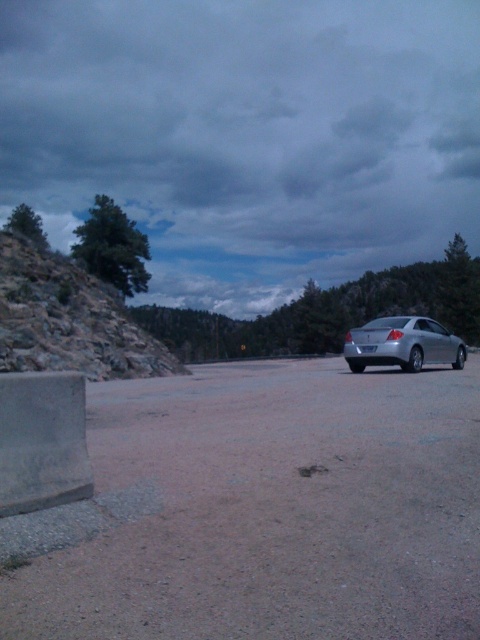
Question: Which object is farther from the camera taking this photo?

Choices:
 (A) silver metallic sedan at right
 (B) brown gravel dirt track at center

Answer: (A)

Question: Is brown gravel dirt track at center positioned before silver metallic sedan at right?

Choices:
 (A) yes
 (B) no

Answer: (A)

Question: Is brown gravel dirt track at center positioned before silver metallic sedan at right?

Choices:
 (A) yes
 (B) no

Answer: (A)

Question: Among these objects, which one is farthest from the camera?

Choices:
 (A) silver metallic sedan at right
 (B) brown gravel dirt track at center

Answer: (A)

Question: Is brown gravel dirt track at center in front of silver metallic sedan at right?

Choices:
 (A) no
 (B) yes

Answer: (B)